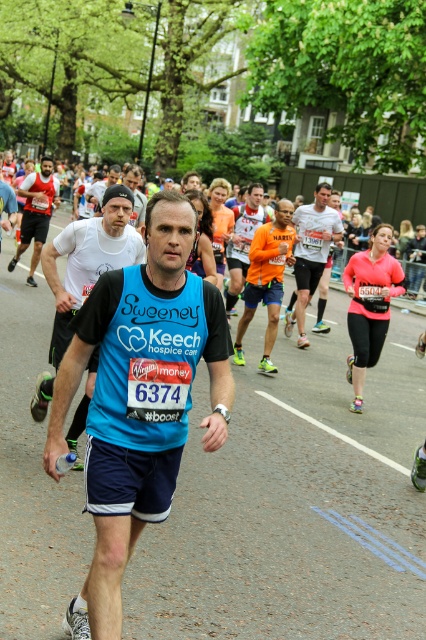
You are a photographer standing at the starting line of the marathon. You want to take a photo of the white matte shirt at center and the matte black cap at upper center. Which object should you adjust your camera to focus on first if you want to capture both in the same frame?

The white matte shirt at center is to the right of the matte black cap at upper center. To capture both in the same frame, focus on the matte black cap at upper center first as it is closer to the upper part of the frame, then adjust to include the white matte shirt at center to the right.

You are a photographer at the marathon event. You need to capture a photo where both the blue fabric vest at center and the orange reflective vest at center are visible. Based on their heights, which vest will appear shorter in the photo?

The blue fabric vest at center will appear shorter in the photo because it is not as tall as the orange reflective vest at center.

Based on the marathon scene described, what is located at the coordinates point (311, 252)?

The white matte shirt at center is located at point (311, 252).